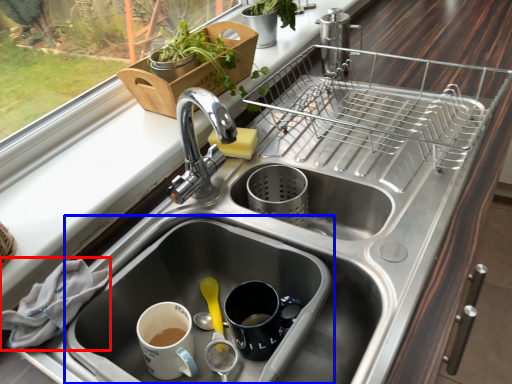
Question: Which object is closer to the camera taking this photo, material (highlighted by a red box) or sink (highlighted by a blue box)?

Choices:
 (A) material
 (B) sink

Answer: (B)